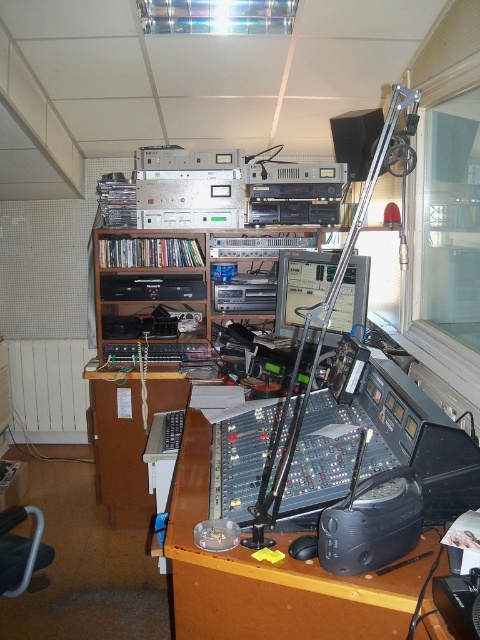
Consider the image. Between brown wooden desk at center and black matte speaker at upper center, which one appears on the right side from the viewer's perspective?

black matte speaker at upper center is more to the right.

Find the location of `brown wooden desk at center`. brown wooden desk at center is located at coordinates (272, 577).